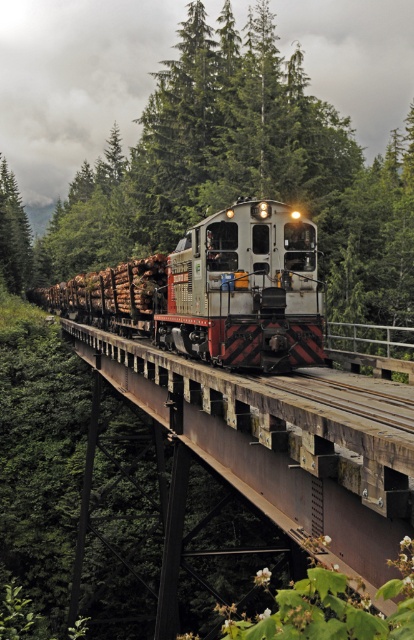
Does metallic silver train at center have a larger size compared to brown wooden train track at center?

Yes.

Who is higher up, metallic silver train at center or brown wooden train track at center?

metallic silver train at center is higher up.

Identify the location of metallic silver train at center. The height and width of the screenshot is (640, 414). pos(214,291).

Is green textured tree at center further to camera compared to green matte tree at left?

No, it is in front of green matte tree at left.

Which is below, green textured tree at center or green matte tree at left?

green matte tree at left

Is point (332, 214) farther from camera compared to point (28, 236)?

That is False.

Identify the location of green textured tree at center. The image size is (414, 640). (245, 172).

Based on the photo, is brown wooden train track at center taller than green matte tree at left?

No, brown wooden train track at center is not taller than green matte tree at left.

Is brown wooden train track at center wider than green matte tree at left?

In fact, brown wooden train track at center might be narrower than green matte tree at left.

Find the location of a particular element. The image size is (414, 640). brown wooden train track at center is located at coordinates (346, 396).